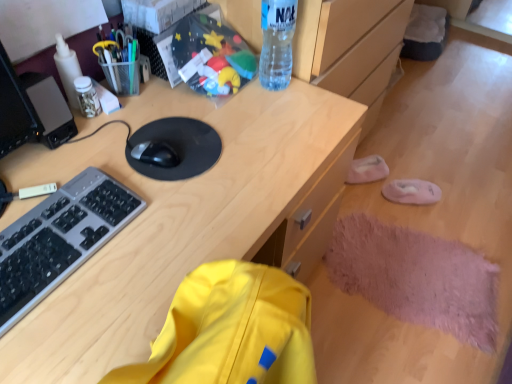
Question: Does white plastic bottle at upper left, which ranks as the first bottle in left-to-right order, touch black matte mousepad at center?

Choices:
 (A) no
 (B) yes

Answer: (A)

Question: Does white plastic bottle at upper left, the 2th bottle from the right, lie behind black matte mousepad at center?

Choices:
 (A) no
 (B) yes

Answer: (B)

Question: Does white plastic bottle at upper left, the 2th bottle from the right, have a larger size compared to black matte mousepad at center?

Choices:
 (A) no
 (B) yes

Answer: (A)

Question: Is white plastic bottle at upper left, which ranks as the first bottle in left-to-right order, to the left of black matte mousepad at center from the viewer's perspective?

Choices:
 (A) no
 (B) yes

Answer: (B)

Question: Is white plastic bottle at upper left, the 2th bottle from the right, taller than black matte mousepad at center?

Choices:
 (A) yes
 (B) no

Answer: (A)

Question: Considering the relative positions of white plastic bottle at upper left, which ranks as the first bottle in left-to-right order, and transparent plastic bottle at upper center, the second bottle in the left-to-right sequence, in the image provided, is white plastic bottle at upper left, which ranks as the first bottle in left-to-right order, to the left or to the right of transparent plastic bottle at upper center, the second bottle in the left-to-right sequence,?

Choices:
 (A) left
 (B) right

Answer: (A)

Question: Is white plastic bottle at upper left, which ranks as the first bottle in left-to-right order, inside or outside of transparent plastic bottle at upper center, positioned as the first bottle in right-to-left order?

Choices:
 (A) outside
 (B) inside

Answer: (A)

Question: Relative to transparent plastic bottle at upper center, the second bottle in the left-to-right sequence, is white plastic bottle at upper left, which ranks as the first bottle in left-to-right order, in front or behind?

Choices:
 (A) front
 (B) behind

Answer: (B)

Question: From a real-world perspective, is white plastic bottle at upper left, which ranks as the first bottle in left-to-right order, positioned above or below transparent plastic bottle at upper center, positioned as the first bottle in right-to-left order?

Choices:
 (A) below
 (B) above

Answer: (A)

Question: From the image's perspective, is white plastic bottle at upper left, the 2th bottle from the right, above or below black matte mouse at center?

Choices:
 (A) above
 (B) below

Answer: (A)

Question: Does point (67, 46) appear closer or farther from the camera than point (154, 163)?

Choices:
 (A) closer
 (B) farther

Answer: (B)

Question: In terms of size, does white plastic bottle at upper left, the 2th bottle from the right, appear bigger or smaller than black matte mouse at center?

Choices:
 (A) small
 (B) big

Answer: (B)

Question: Visually, is white plastic bottle at upper left, the 2th bottle from the right, positioned to the left or to the right of black matte mouse at center?

Choices:
 (A) right
 (B) left

Answer: (B)

Question: From the image's perspective, is gray plastic keyboard at left located above or below translucent plastic jar at upper left, positioned as the 1th stationery in left-to-right order?

Choices:
 (A) below
 (B) above

Answer: (A)

Question: Is gray plastic keyboard at left spatially inside translucent plastic jar at upper left, positioned as the 1th stationery in left-to-right order, or outside of it?

Choices:
 (A) inside
 (B) outside

Answer: (B)